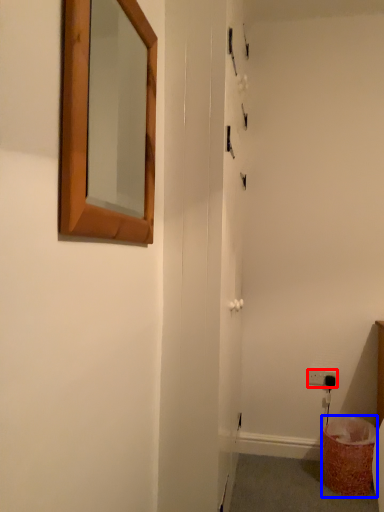
Question: Which object appears closest to the camera in this image, electric outlet (highlighted by a red box) or laundry basket (highlighted by a blue box)?

Choices:
 (A) electric outlet
 (B) laundry basket

Answer: (B)